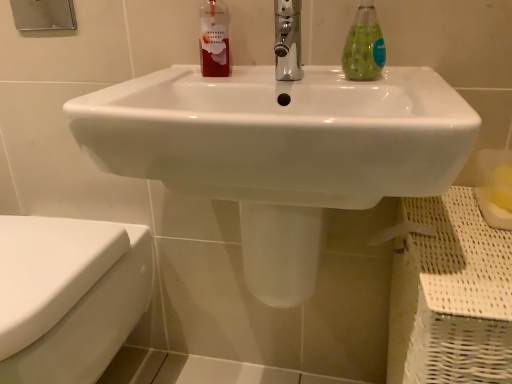
Where is `white glossy toilet at lower left`? Image resolution: width=512 pixels, height=384 pixels. white glossy toilet at lower left is located at coordinates pyautogui.click(x=69, y=295).

The width and height of the screenshot is (512, 384). Find the location of `matte plastic bottle at upper center`. matte plastic bottle at upper center is located at coordinates (214, 39).

At what (x,y) coordinates should I click in order to perform the action: click on chrome metallic faucet at center. Please return your answer as a coordinate pair (x, y). This screenshot has height=384, width=512. Looking at the image, I should click on (288, 40).

At what (x,y) coordinates should I click in order to perform the action: click on white glossy toilet at lower left. Please return your answer as a coordinate pair (x, y). The image size is (512, 384). Looking at the image, I should click on coord(69,295).

Considering the relative positions of white glossy sink at center and translucent green liquid at sink right in the image provided, is white glossy sink at center to the right of translucent green liquid at sink right from the viewer's perspective?

Incorrect, white glossy sink at center is not on the right side of translucent green liquid at sink right.

From the image's perspective, does white glossy sink at center appear lower than translucent green liquid at sink right?

Yes, from the image's perspective, white glossy sink at center is beneath translucent green liquid at sink right.

Is the surface of white glossy sink at center in direct contact with translucent green liquid at sink right?

They are not placed beside each other.

Is white glossy sink at center wider or thinner than translucent green liquid at sink right?

In the image, white glossy sink at center appears to be wider than translucent green liquid at sink right.

Could you tell me if translucent green liquid at sink right is turned towards white glossy sink at center?

No, translucent green liquid at sink right is not turned towards white glossy sink at center.

From a real-world perspective, is translucent green liquid at sink right physically below white glossy sink at center?

No, from a real-world perspective, translucent green liquid at sink right is not under white glossy sink at center.

Locate an element on the screen. soap dispenser to the right of white glossy sink at center is located at coordinates (364, 46).

In the scene shown: Considering the relative sizes of white glossy sink at center and white glossy toilet at lower left in the image provided, is white glossy sink at center bigger than white glossy toilet at lower left?

Correct, white glossy sink at center is larger in size than white glossy toilet at lower left.

Is white glossy toilet at lower left completely or partially inside white glossy sink at center?

Actually, white glossy toilet at lower left is outside white glossy sink at center.

Is white glossy sink at center oriented away from white glossy toilet at lower left?

white glossy sink at center is not turned away from white glossy toilet at lower left.

Is chrome metallic faucet at center positioned with its back to matte plastic bottle at upper center?

No, chrome metallic faucet at center is not facing the opposite direction of matte plastic bottle at upper center.

Is chrome metallic faucet at center directly adjacent to matte plastic bottle at upper center?

No.

Visually, is chrome metallic faucet at center positioned to the left or to the right of matte plastic bottle at upper center?

In the image, chrome metallic faucet at center appears on the right side of matte plastic bottle at upper center.

Based on their sizes in the image, would you say chrome metallic faucet at center is bigger or smaller than matte plastic bottle at upper center?

chrome metallic faucet at center is bigger than matte plastic bottle at upper center.

Is matte plastic bottle at upper center oriented away from white glossy toilet at lower left?

No, white glossy toilet at lower left is not at the back of matte plastic bottle at upper center.

From the picture: From the image's perspective, is matte plastic bottle at upper center on top of white glossy toilet at lower left?

Yes, from the image's perspective, matte plastic bottle at upper center is above white glossy toilet at lower left.

Is matte plastic bottle at upper center touching white glossy toilet at lower left?

matte plastic bottle at upper center and white glossy toilet at lower left are not in contact.

Between matte plastic bottle at upper center and white glossy toilet at lower left, which one has less height?

matte plastic bottle at upper center.

Is the depth of translucent green liquid at sink right greater than that of chrome metallic faucet at center?

Yes, translucent green liquid at sink right is behind chrome metallic faucet at center.

Does translucent green liquid at sink right have a greater width compared to chrome metallic faucet at center?

In fact, translucent green liquid at sink right might be narrower than chrome metallic faucet at center.

Does translucent green liquid at sink right turn towards chrome metallic faucet at center?

No, translucent green liquid at sink right is not aimed at chrome metallic faucet at center.

Is translucent green liquid at sink right far from chrome metallic faucet at center?

Actually, translucent green liquid at sink right and chrome metallic faucet at center are a little close together.

How different are the orientations of chrome metallic faucet at center and translucent green liquid at sink right in degrees?

0.000784 degrees.

Find the location of `tap below the translucent green liquid at sink right (from a real-world perspective)`. tap below the translucent green liquid at sink right (from a real-world perspective) is located at coordinates (288, 40).

From a real-world perspective, is chrome metallic faucet at center above or below translucent green liquid at sink right?

chrome metallic faucet at center is situated lower than translucent green liquid at sink right in the real world.

The height and width of the screenshot is (384, 512). I want to click on soap dispenser behind the white glossy sink at center, so click(364, 46).

The height and width of the screenshot is (384, 512). Identify the location of soap dispenser positioned vertically above the white glossy sink at center (from a real-world perspective). (364, 46).

Considering their positions, is white glossy sink at center positioned further to translucent green liquid at sink right than white glossy toilet at lower left?

white glossy toilet at lower left is further to translucent green liquid at sink right.

When comparing their distances from chrome metallic faucet at center, does translucent green liquid at sink right or white glossy sink at center seem further?

white glossy sink at center.

Considering their positions, is translucent green liquid at sink right positioned closer to white glossy sink at center than chrome metallic faucet at center?

chrome metallic faucet at center is closer to white glossy sink at center.

Based on their spatial positions, is matte plastic bottle at upper center or chrome metallic faucet at center further from white glossy toilet at lower left?

chrome metallic faucet at center lies further to white glossy toilet at lower left than the other object.

Which object lies nearer to the anchor point chrome metallic faucet at center, white glossy sink at center or matte plastic bottle at upper center?

Based on the image, matte plastic bottle at upper center appears to be nearer to chrome metallic faucet at center.

Which object lies nearer to the anchor point matte plastic bottle at upper center, white glossy sink at center or white glossy toilet at lower left?

white glossy sink at center.

Considering their positions, is translucent green liquid at sink right positioned closer to white glossy toilet at lower left than chrome metallic faucet at center?

chrome metallic faucet at center is closer to white glossy toilet at lower left.

Based on their spatial positions, is translucent green liquid at sink right or matte plastic bottle at upper center further from white glossy sink at center?

Among the two, matte plastic bottle at upper center is located further to white glossy sink at center.

Locate an element on the screen. Image resolution: width=512 pixels, height=384 pixels. sink between white glossy toilet at lower left and translucent green liquid at sink right from left to right is located at coordinates (281, 150).

Find the location of a particular element. The width and height of the screenshot is (512, 384). tap between white glossy toilet at lower left and translucent green liquid at sink right in the horizontal direction is located at coordinates (288, 40).

At what (x,y) coordinates should I click in order to perform the action: click on tap between matte plastic bottle at upper center and white glossy toilet at lower left from top to bottom. Please return your answer as a coordinate pair (x, y). Looking at the image, I should click on (288, 40).

This screenshot has height=384, width=512. I want to click on sink that lies between matte plastic bottle at upper center and white glossy toilet at lower left from top to bottom, so click(281, 150).